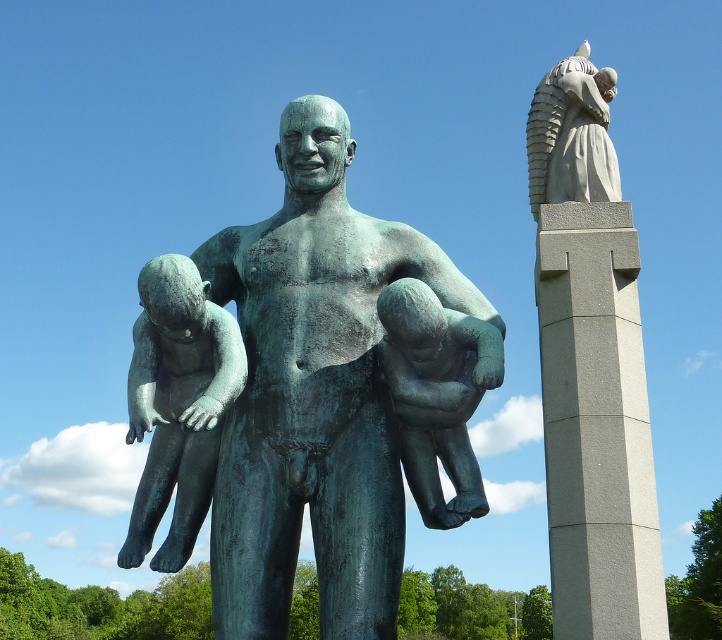
You are a maintenance worker checking the stability of the gray concrete pillar at right and the polished bronze child at left. Which object is located directly beneath the other?

The gray concrete pillar at right is positioned under the polished bronze child at left, meaning the pillar supports the child.

You are standing in front of the bronze statue of a man holding two children. There is a gray concrete pillar at right. If you want to walk directly to the pillar from the bronze statue, in which direction should you move?

The gray concrete pillar at right is located at point 0.666 on the x and 0.827 on the y axis, so you should move to the right and slightly forward to reach it.